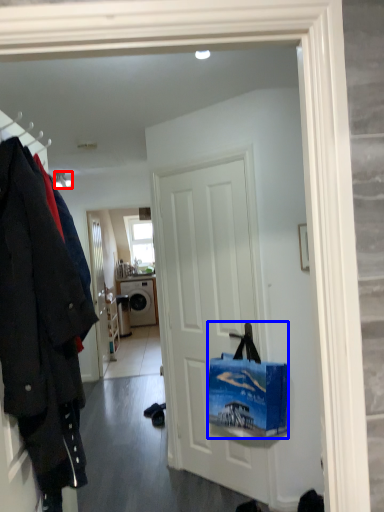
Question: Which of the following is the farthest to the observer, lamp (highlighted by a red box) or handbag (highlighted by a blue box)?

Choices:
 (A) lamp
 (B) handbag

Answer: (A)